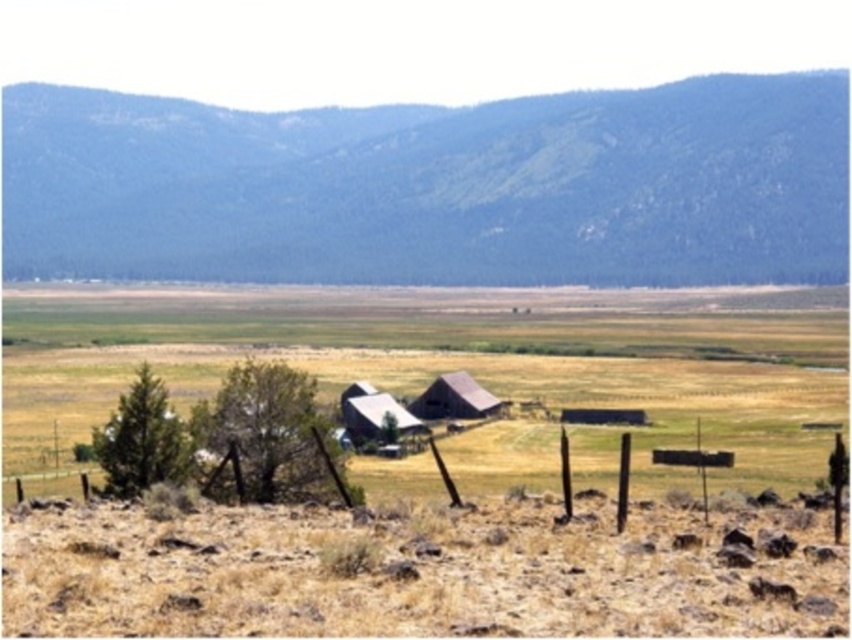
You are a hiker standing at the base of the green textured mountain at upper center and looking towards the brown wooden fence at lower center. Which object appears larger in your field of view?

The green textured mountain at upper center appears larger in your field of view because it is much taller than the brown wooden fence at lower center.

From the picture: You are standing in the middle of the open field in the rural landscape. You see the green textured mountain at upper center and the brown wooden fence at lower center. Which object is higher in the image?

The green textured mountain at upper center is higher in the image because it is positioned above the brown wooden fence at lower center.